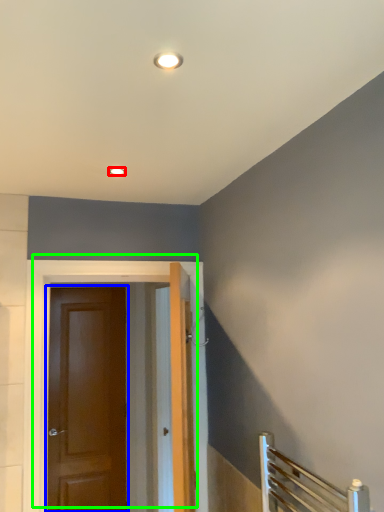
Question: Which object is the farthest from lighting (highlighted by a red box)? Choose among these: door (highlighted by a blue box) or door (highlighted by a green box).

Choices:
 (A) door
 (B) door

Answer: (A)